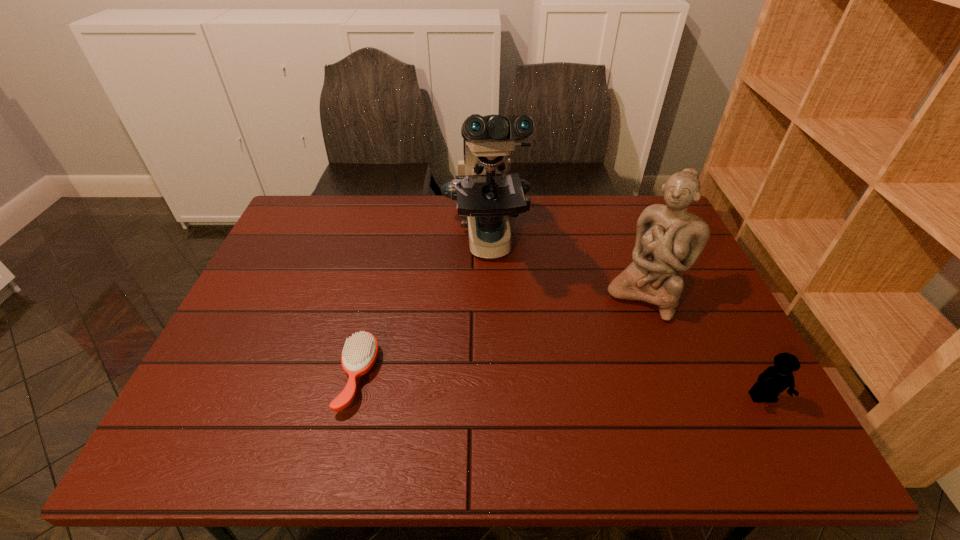
The width and height of the screenshot is (960, 540). I want to click on vacant region that satisfies the following two spatial constraints: 1. on the back side of the figurine; 2. on the left side of the hairbrush, so click(x=377, y=296).